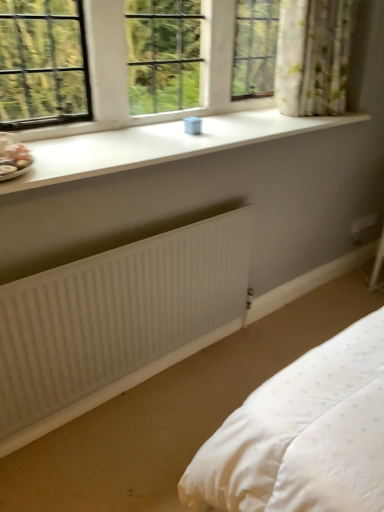
Question: Considering the positions of floral fabric curtain at upper right and white plastic container at upper center in the image, is floral fabric curtain at upper right bigger or smaller than white plastic container at upper center?

Choices:
 (A) small
 (B) big

Answer: (B)

Question: From a real-world perspective, relative to white plastic container at upper center, is floral fabric curtain at upper right vertically above or below?

Choices:
 (A) above
 (B) below

Answer: (B)

Question: Estimate the real-world distances between objects in this image. Which object is closer to the white ribbed radiator at lower center?

Choices:
 (A) matte pink porcelain at left
 (B) white smooth window sill at upper center
 (C) floral fabric curtain at upper right
 (D) white plastic container at upper center

Answer: (B)

Question: Estimate the real-world distances between objects in this image. Which object is farther from the matte pink porcelain at left?

Choices:
 (A) floral fabric curtain at upper right
 (B) white plastic container at upper center
 (C) white smooth window sill at upper center
 (D) white ribbed radiator at lower center

Answer: (A)